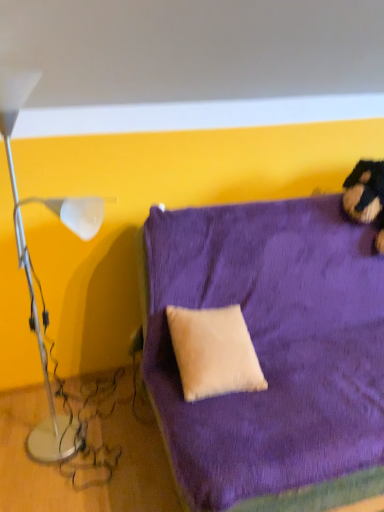
Question: From the image's perspective, is white glossy lamp at left located above or below beige suede pillow at center?

Choices:
 (A) below
 (B) above

Answer: (B)

Question: In the image, is white glossy lamp at left positioned in front of or behind beige suede pillow at center?

Choices:
 (A) front
 (B) behind

Answer: (A)

Question: Estimate the real-world distances between objects in this image. Which object is closer to the white glossy lamp at left?

Choices:
 (A) velvet purple couch at center
 (B) beige suede pillow at center

Answer: (B)

Question: Which object is the closest to the beige suede pillow at center?

Choices:
 (A) velvet purple couch at center
 (B) white glossy lamp at left

Answer: (A)